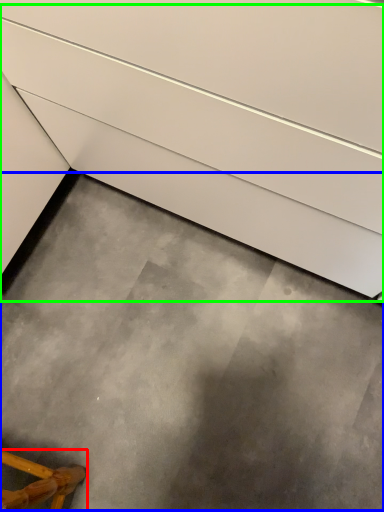
Question: Based on their relative distances, which object is nearer to furniture (highlighted by a red box)? Choose from concrete (highlighted by a blue box) and stairs (highlighted by a green box).

Choices:
 (A) concrete
 (B) stairs

Answer: (A)